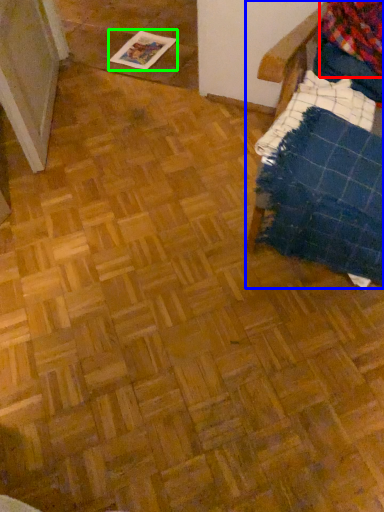
Question: Considering the real-world distances, which object is farthest from flannel (highlighted by a red box)? furniture (highlighted by a blue box) or magazine (highlighted by a green box)?

Choices:
 (A) furniture
 (B) magazine

Answer: (B)